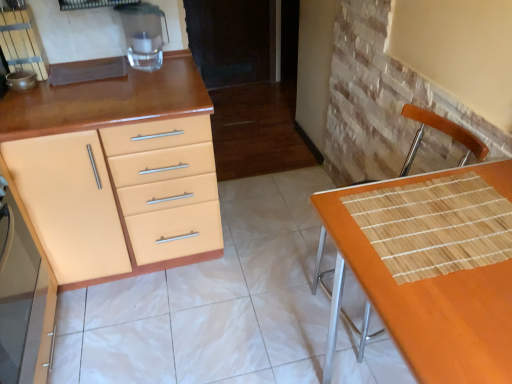
The width and height of the screenshot is (512, 384). I want to click on free location to the right of matte orange cabinet at left, the 1th cabinetry from the back, so click(265, 259).